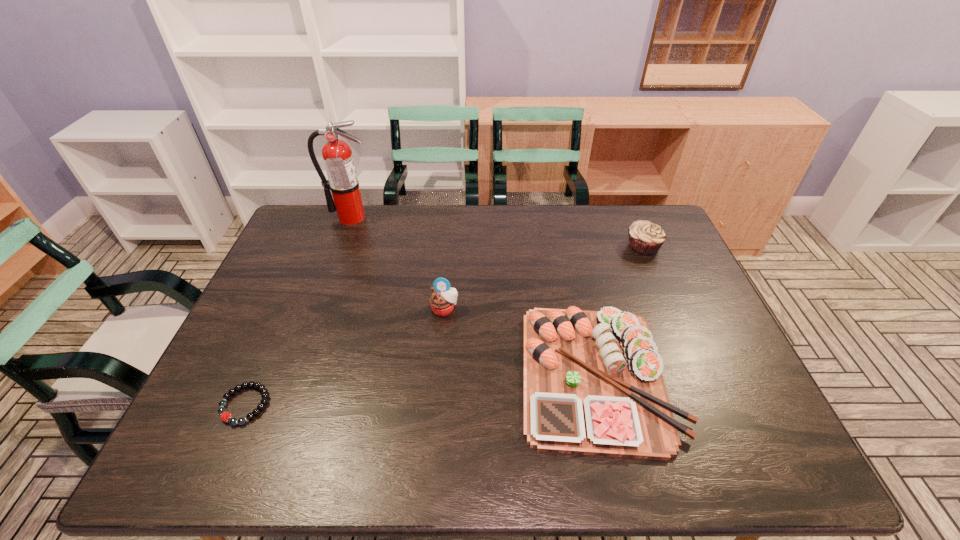
Identify the location of vacant point located between the shortest object and the nearer muffin. (345, 357).

Locate an element on the screen. free point between the shortest object and the third object from right to left is located at coordinates (345, 357).

You are a GUI agent. You are given a task and a screenshot of the screen. Output one action in this format:
    pyautogui.click(x=<x>, y=<y>)
    Task: Click on the free area in between the fire extinguisher and the fourth tallest object
    The width and height of the screenshot is (960, 540).
    Given the screenshot: What is the action you would take?
    pyautogui.click(x=474, y=296)

Locate which object ranks third in proximity to the fourth tallest object. Please provide its 2D coordinates. Your answer should be formatted as a tuple, i.e. [(x, y)], where the tuple contains the x and y coordinates of a point satisfying the conditions above.

[(225, 416)]

Locate which object is the third closest to the platter. Please provide its 2D coordinates. Your answer should be formatted as a tuple, i.e. [(x, y)], where the tuple contains the x and y coordinates of a point satisfying the conditions above.

[(225, 416)]

In order to click on vacant space that satisfies the following two spatial constraints: 1. on the nozzle side of the farthest object; 2. on the right side of the farther muffin in this screenshot , I will do `click(340, 247)`.